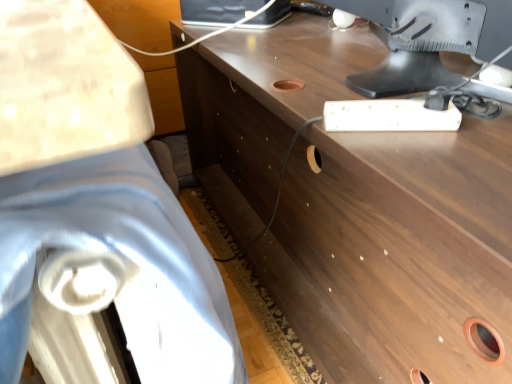
Question: Is satin silver monitor at upper right bigger or smaller than brown wood desk at center?

Choices:
 (A) big
 (B) small

Answer: (B)

Question: From their relative heights in the image, would you say satin silver monitor at upper right is taller or shorter than brown wood desk at center?

Choices:
 (A) tall
 (B) short

Answer: (B)

Question: Based on their relative distances, which object is nearer to the satin silver monitor at upper right?

Choices:
 (A) brown wood desk at center
 (B) white fabric swivel chair at left

Answer: (A)

Question: Which object is the farthest from the satin silver monitor at upper right?

Choices:
 (A) brown wood desk at center
 (B) white fabric swivel chair at left

Answer: (B)